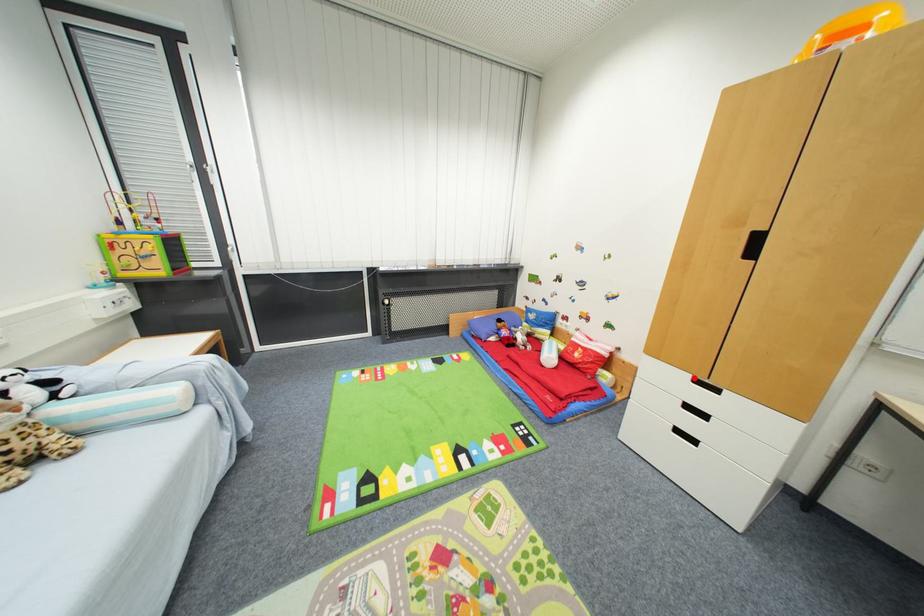
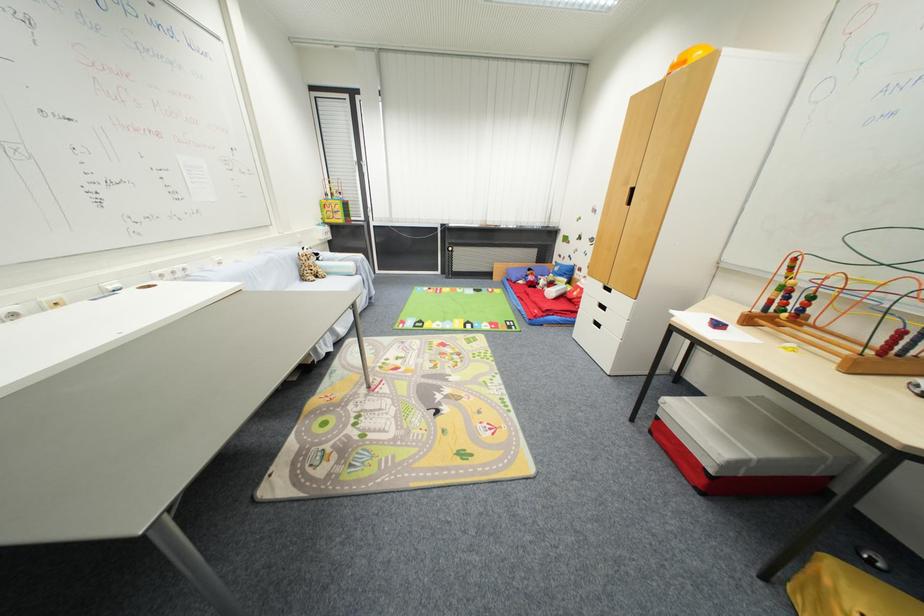
Question: I am providing you with two images of the same scene from different viewpoints. In image1, a red point is highlighted. Considering the same 3D point in image2, which of the following is correct?

Choices:
 (A) It is closer
 (B) It is farther

Answer: (A)